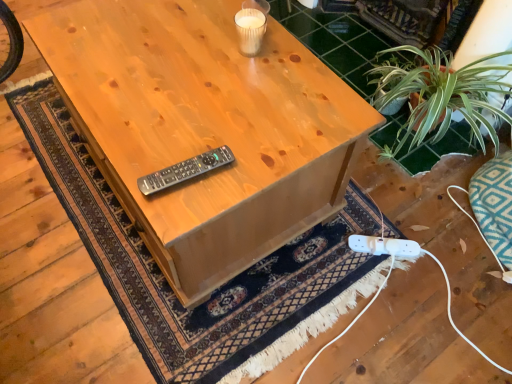
Locate an element on the screen. free region on the left part of black plastic remote at center is located at coordinates coord(132,150).